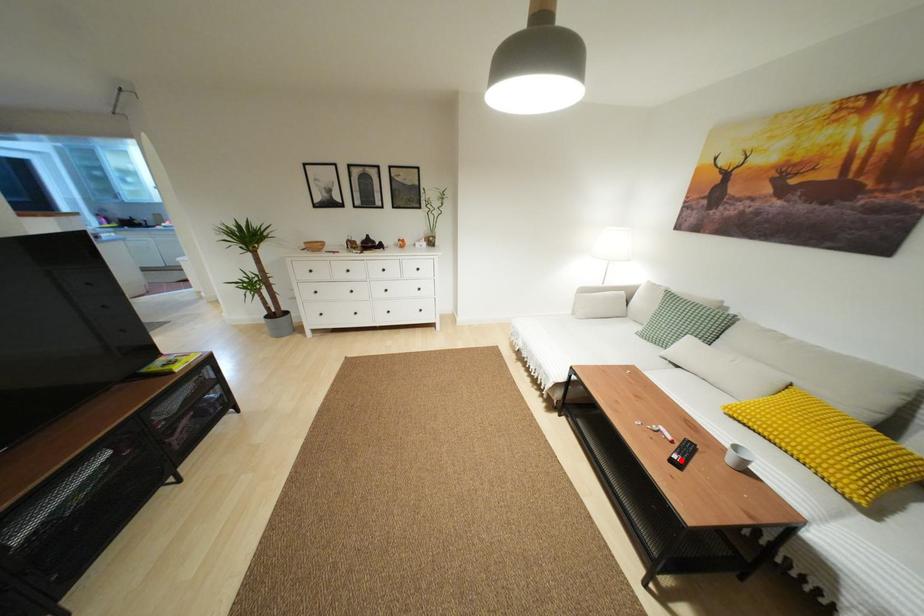
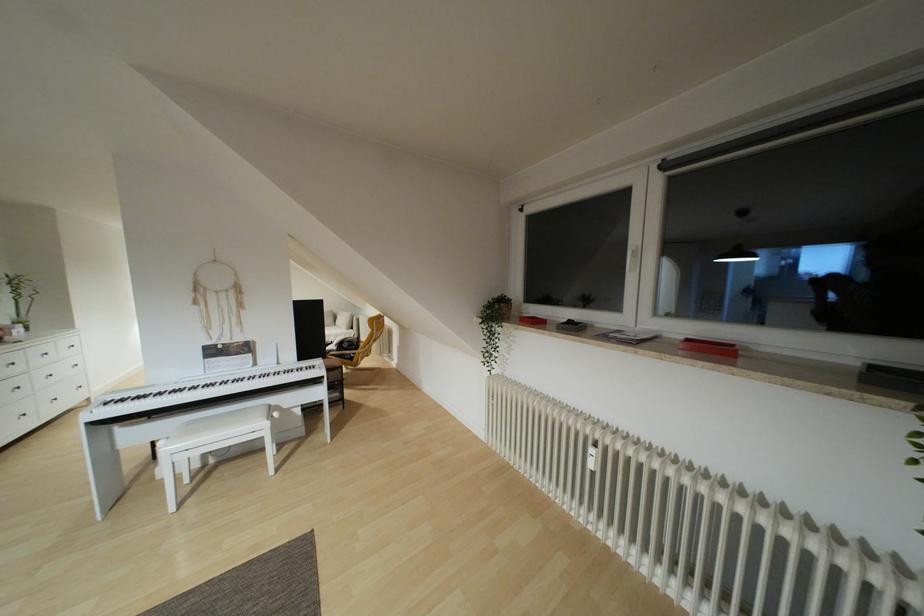
Question: I am providing you with two images of the same scene from different viewpoints. A red point is marked on the first image. Can you still see the location of the red point in image 2?

Choices:
 (A) Yes
 (B) No

Answer: (B)